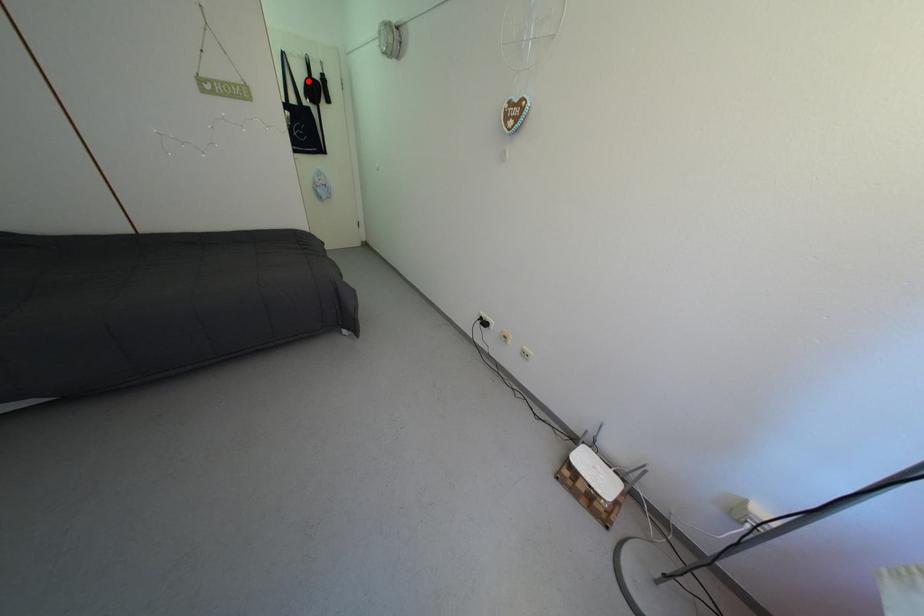
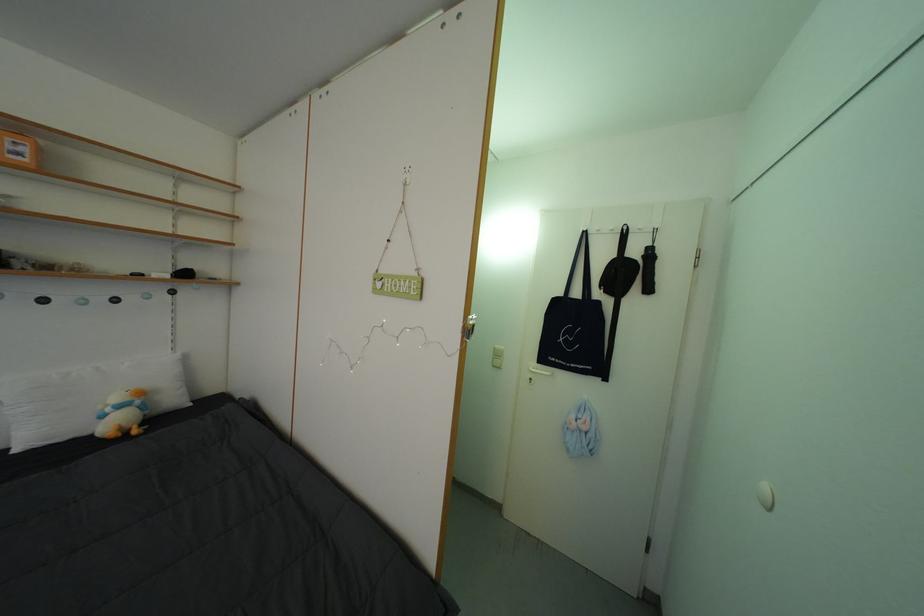
Question: I am providing you with two images of the same scene from different viewpoints. A red point is marked on the first image. Is the red point's position out of view in image 2?

Choices:
 (A) Yes
 (B) No

Answer: (B)